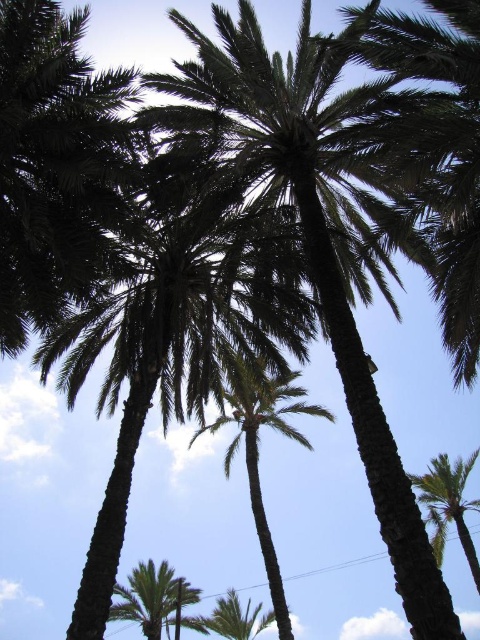
Between point (251, 397) and point (467, 545), which one is positioned in front?

Positioned in front is point (467, 545).

Is point (283, 378) farther from camera compared to point (441, 461)?

No, (283, 378) is closer to viewer.

Which is in front, point (233, 404) or point (444, 509)?

Point (233, 404) is in front.

The height and width of the screenshot is (640, 480). What are the coordinates of `green leafy palm at center` in the screenshot? It's located at (257, 449).

Is dark green leafy palm tree at center above green leafy palm tree at lower right?

Indeed, dark green leafy palm tree at center is positioned over green leafy palm tree at lower right.

Is point (261, 288) closer to viewer compared to point (410, 474)?

Yes, point (261, 288) is closer to viewer.

The width and height of the screenshot is (480, 640). In order to click on dark green leafy palm tree at center in this screenshot , I will do `click(179, 332)`.

Can you confirm if dark green leafy palm tree at center is positioned to the right of green leafy palm tree at lower left?

Correct, you'll find dark green leafy palm tree at center to the right of green leafy palm tree at lower left.

Between point (194, 310) and point (118, 602), which one is positioned behind?

The point (118, 602) is more distant.

Measure the distance between point (45, 346) and camera.

Point (45, 346) is 17.74 meters from camera.

Locate an element on the screen. Image resolution: width=480 pixels, height=640 pixels. dark green leafy palm tree at center is located at coordinates (179, 332).